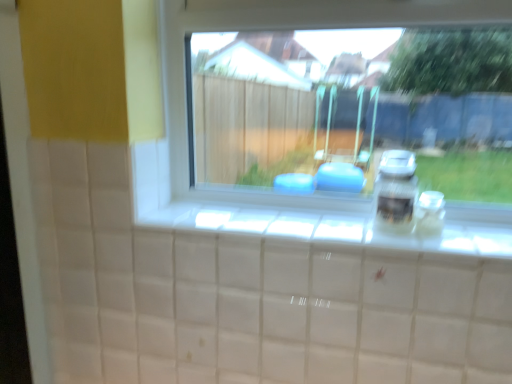
Where is `vacant area in front of transparent glass jar at right`? The image size is (512, 384). vacant area in front of transparent glass jar at right is located at coordinates (455, 248).